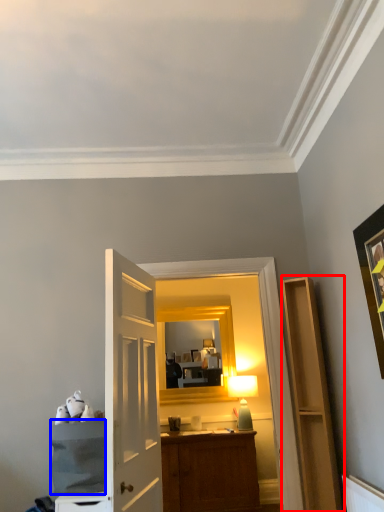
Question: Among these objects, which one is nearest to the camera, cabinetry (highlighted by a red box) or cabinetry (highlighted by a blue box)?

Choices:
 (A) cabinetry
 (B) cabinetry

Answer: (B)